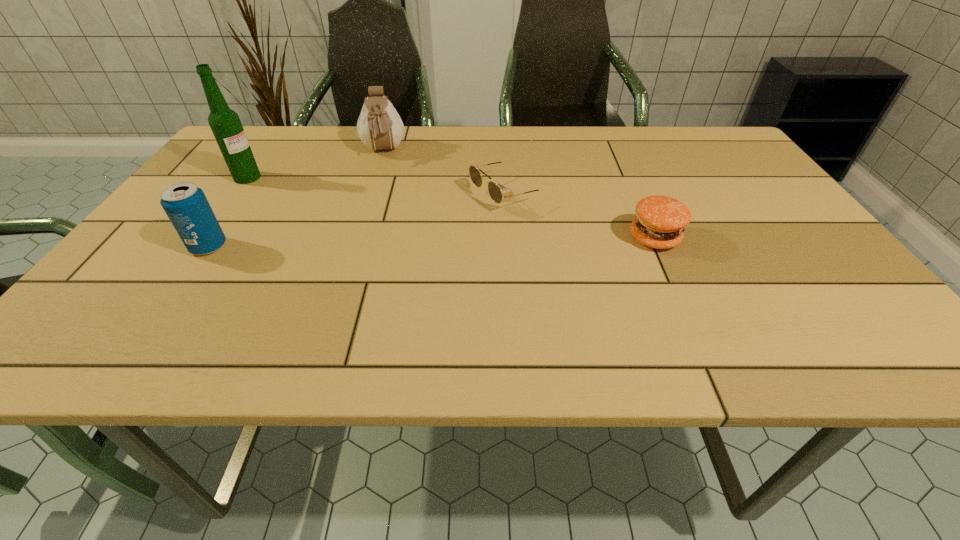
You are a GUI agent. You are given a task and a screenshot of the screen. Output one action in this format:
    pyautogui.click(x=<x>, y=<y>)
    Task: Click on the free space at the far edge
    The width and height of the screenshot is (960, 540).
    Given the screenshot: What is the action you would take?
    [x=369, y=166]

Image resolution: width=960 pixels, height=540 pixels. In the image, there is a desktop. What are the coordinates of `vacant space at the near edge` in the screenshot? It's located at (254, 318).

Locate an element on the screen. This screenshot has height=540, width=960. vacant region at the left edge of the desktop is located at coordinates (210, 201).

In the image, there is a desktop. Identify the location of vacant space at the right edge. (804, 238).

The image size is (960, 540). In order to click on vacant space at the far right corner of the desktop in this screenshot , I will do `click(688, 138)`.

Find the location of `vacant region between the third tallest object and the rightmost object`. vacant region between the third tallest object and the rightmost object is located at coordinates (431, 242).

The width and height of the screenshot is (960, 540). I want to click on vacant area that lies between the farthest object and the fourth object from left to right, so click(x=445, y=172).

Where is `vacant area that lies between the soda can and the fourth object from left to right`? The image size is (960, 540). vacant area that lies between the soda can and the fourth object from left to right is located at coordinates (358, 220).

Where is `vacant area that lies between the pouch and the beer bottle`? vacant area that lies between the pouch and the beer bottle is located at coordinates (315, 164).

Find the location of a particular element. The width and height of the screenshot is (960, 540). empty space between the beer bottle and the sunglasses is located at coordinates (377, 185).